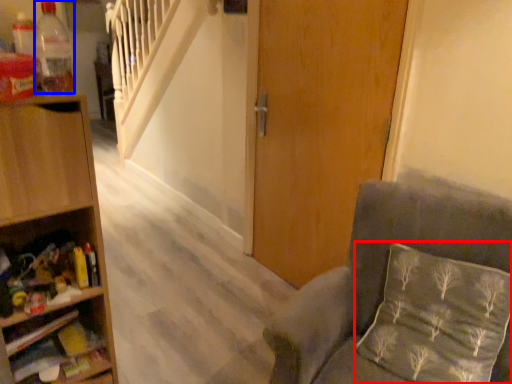
Question: Which object appears closest to the camera in this image, pillow (highlighted by a red box) or bottle (highlighted by a blue box)?

Choices:
 (A) pillow
 (B) bottle

Answer: (B)